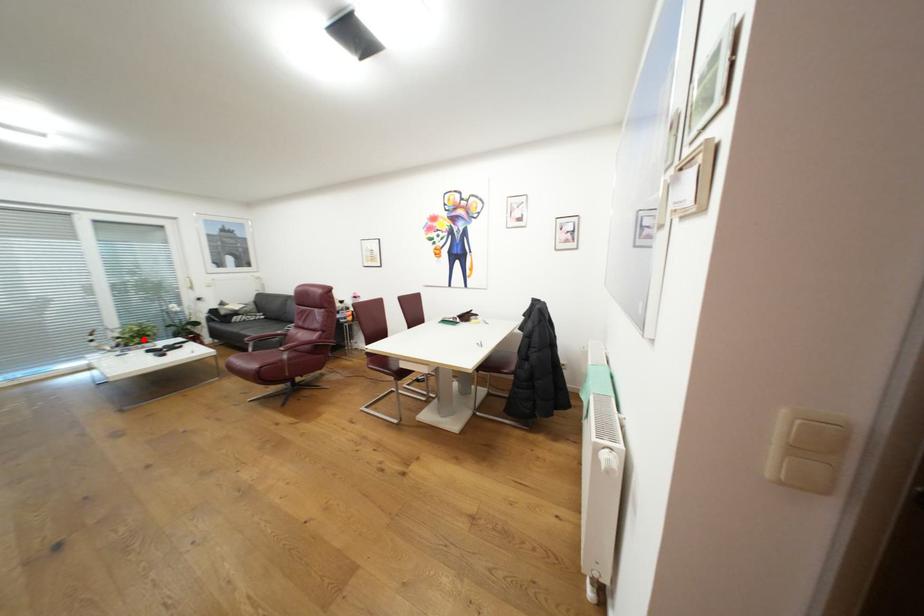
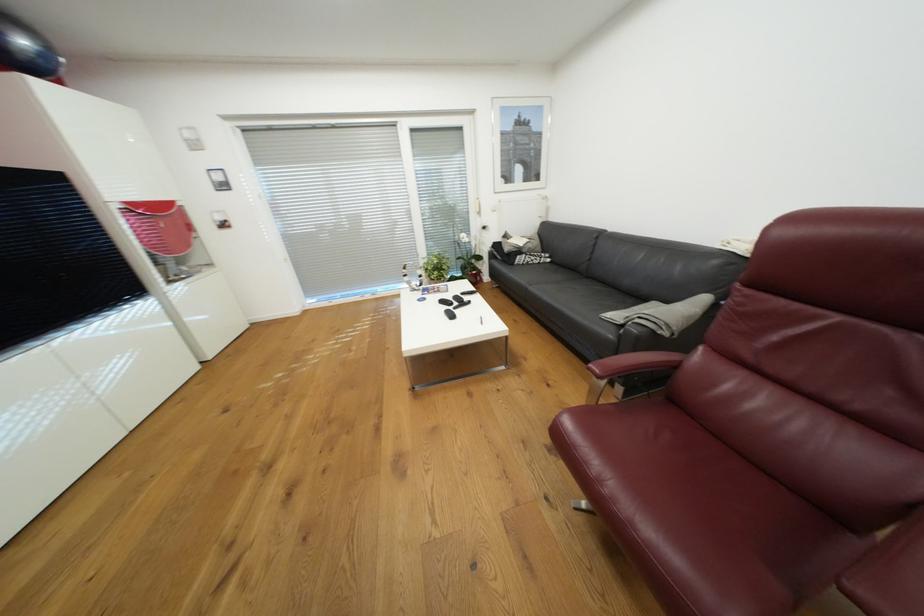
The point at the highlighted location is marked in the first image. Where is the corresponding point in the second image?

(443, 273)